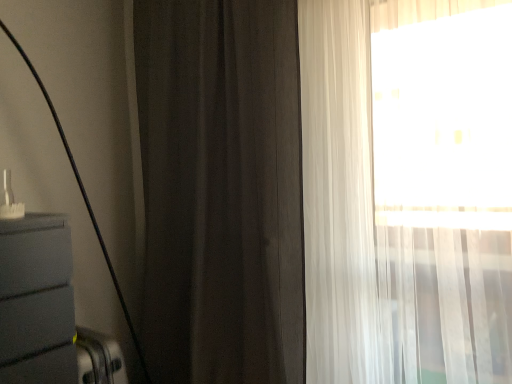
Question: Considering the positions of point (379, 342) and point (260, 377), is point (379, 342) closer or farther from the camera than point (260, 377)?

Choices:
 (A) farther
 (B) closer

Answer: (B)

Question: Looking at their shapes, would you say sheer white curtain at right, which is counted as the 1th curtain, starting from the right, is wider or thinner than dark matte curtain at center, acting as the first curtain starting from the left?

Choices:
 (A) thin
 (B) wide

Answer: (B)

Question: Is sheer white curtain at right, which is counted as the 1th curtain, starting from the right, situated inside dark matte curtain at center, which is the second curtain in right-to-left order, or outside?

Choices:
 (A) inside
 (B) outside

Answer: (B)

Question: Do you think dark matte curtain at center, acting as the first curtain starting from the left, is within sheer white curtain at right, the second curtain when ordered from left to right, or outside of it?

Choices:
 (A) outside
 (B) inside

Answer: (A)

Question: From a real-world perspective, is dark matte curtain at center, acting as the first curtain starting from the left, above or below sheer white curtain at right, the second curtain when ordered from left to right?

Choices:
 (A) below
 (B) above

Answer: (B)

Question: Looking at their shapes, would you say dark matte curtain at center, which is the second curtain in right-to-left order, is wider or thinner than sheer white curtain at right, which is counted as the 1th curtain, starting from the right?

Choices:
 (A) wide
 (B) thin

Answer: (B)

Question: From their relative heights in the image, would you say dark matte curtain at center, which is the second curtain in right-to-left order, is taller or shorter than sheer white curtain at right, the second curtain when ordered from left to right?

Choices:
 (A) tall
 (B) short

Answer: (A)